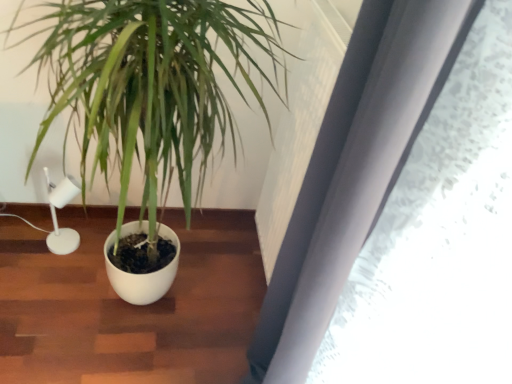
This screenshot has height=384, width=512. In order to click on vacant space that's between white matte lamp at left and green matte plant at center in this screenshot , I will do tap(49, 284).